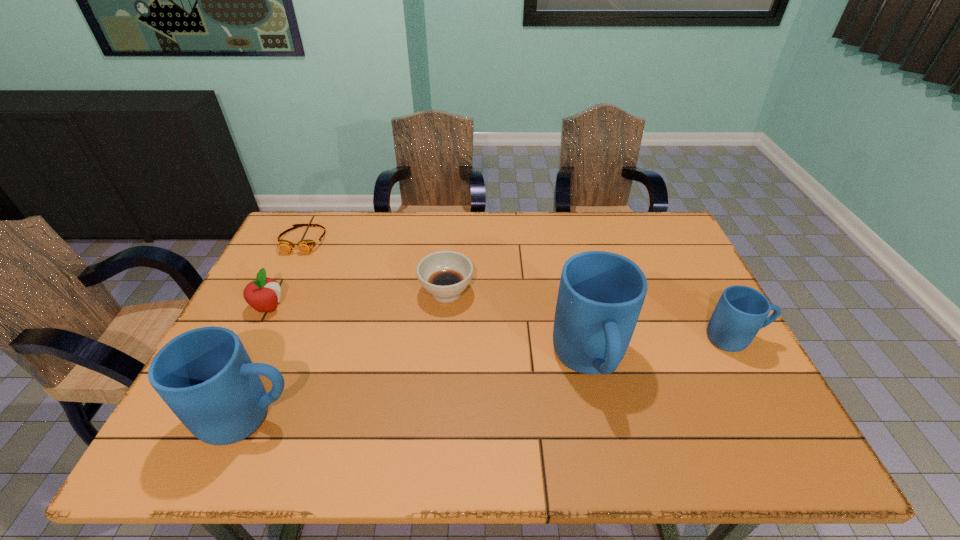
If the aim is uniform spacing by inserting an additional mug among them, please point to a vacant space for this new mug. Please provide its 2D coordinates. Your answer should be formatted as a tuple, i.e. [(x, y)], where the tuple contains the x and y coordinates of a point satisfying the conditions above.

[(429, 388)]